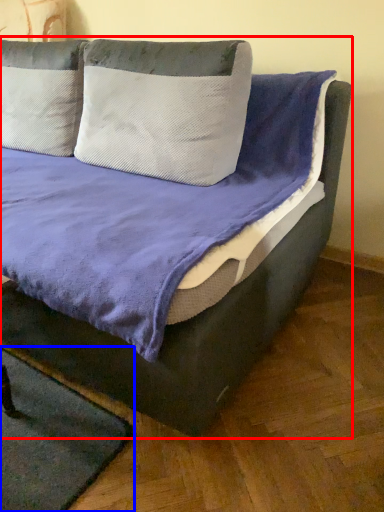
Question: Which object appears farthest to the camera in this image, bed (highlighted by a red box) or mat (highlighted by a blue box)?

Choices:
 (A) bed
 (B) mat

Answer: (B)